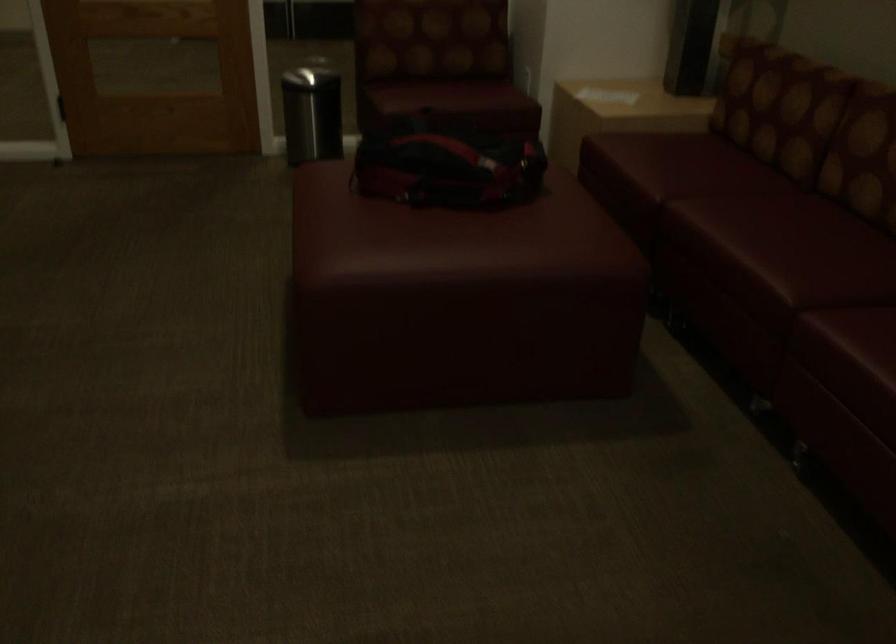
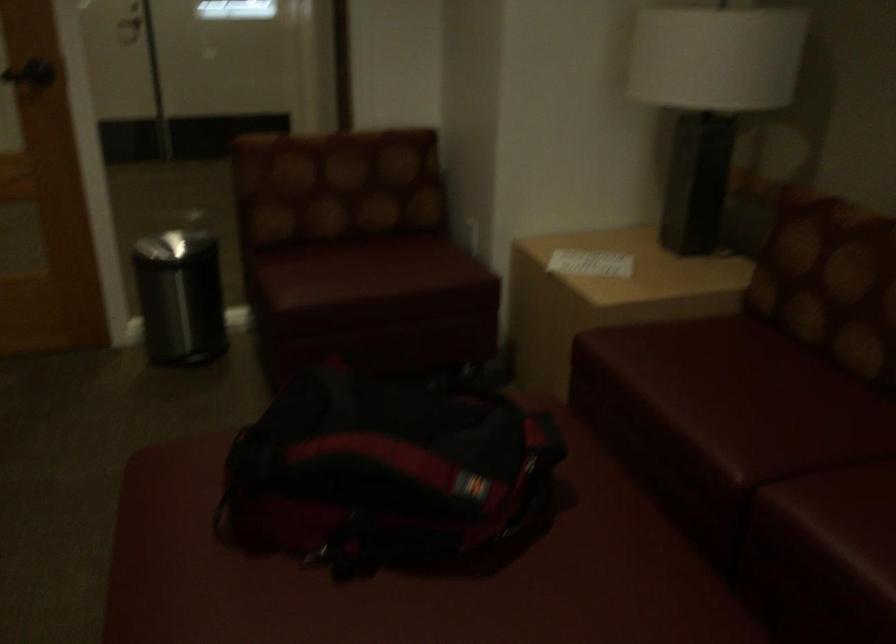
In the second image, find the point that corresponds to (x=436, y=149) in the first image.

(384, 471)